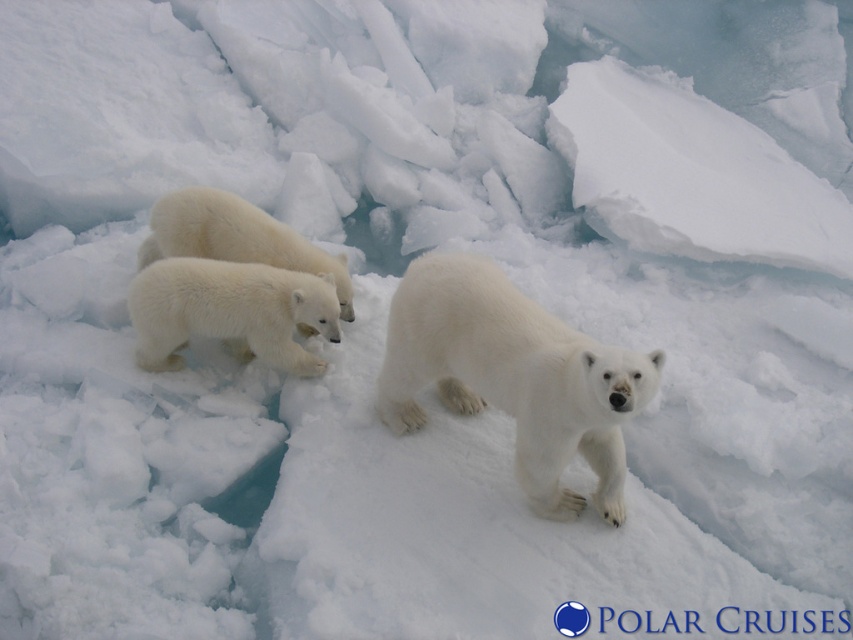
You are a wildlife photographer aiming to capture a photo of the white fur bear at center and the white fluffy bear cub at left. Since both are white, you want to ensure the bear with greater height is in focus. Which bear should you focus on?

The white fur bear at center has a greater height compared to the white fluffy bear cub at left, so you should focus on the white fur bear at center.

You are a wildlife photographer trying to capture a photo of the white fur bear at center and the white fluffy bear cub at left. You need to ensure both subjects are fully visible in the frame. Given that your camera has a fixed focal length, which bear should you position closer to the camera to make them appear the same size in the photo?

Since the white fur bear at center is wider than the white fluffy bear cub at left, you should position the white fluffy bear cub at left closer to the camera to make them appear the same size in the photo.